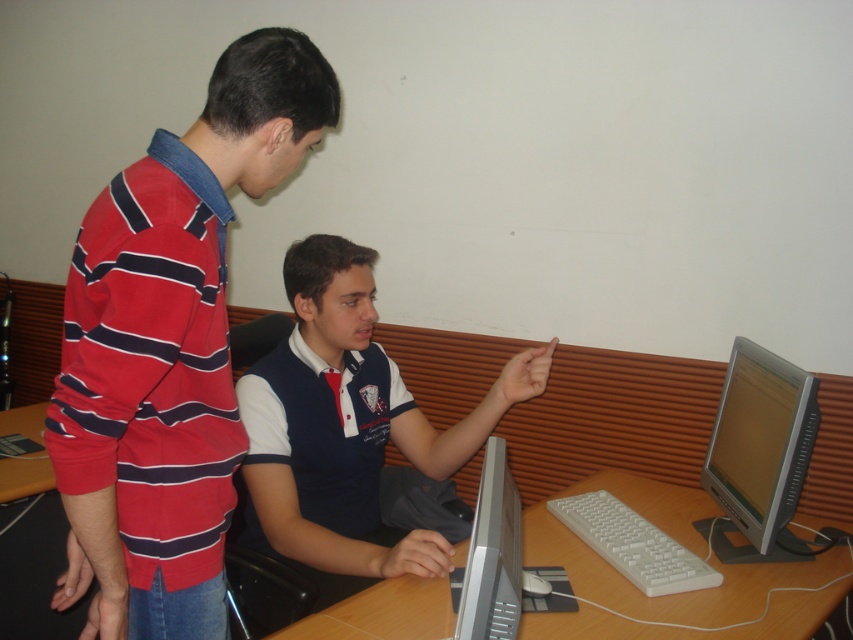
You are trying to set up a new monitor on the wooden table at lower left. The monitor you have is the satin silver monitor at lower center, which is much taller than the table. Will the monitor fit on the table without exceeding the table height?

The satin silver monitor at lower center is much taller than the wooden table at lower left, so the monitor will exceed the table height and won

You are trying to determine which object is taller between the silver metallic monitor at right and the wooden table at lower left. Based on the scene description, which one is taller?

The silver metallic monitor at right is taller than the wooden table at lower left according to the description.